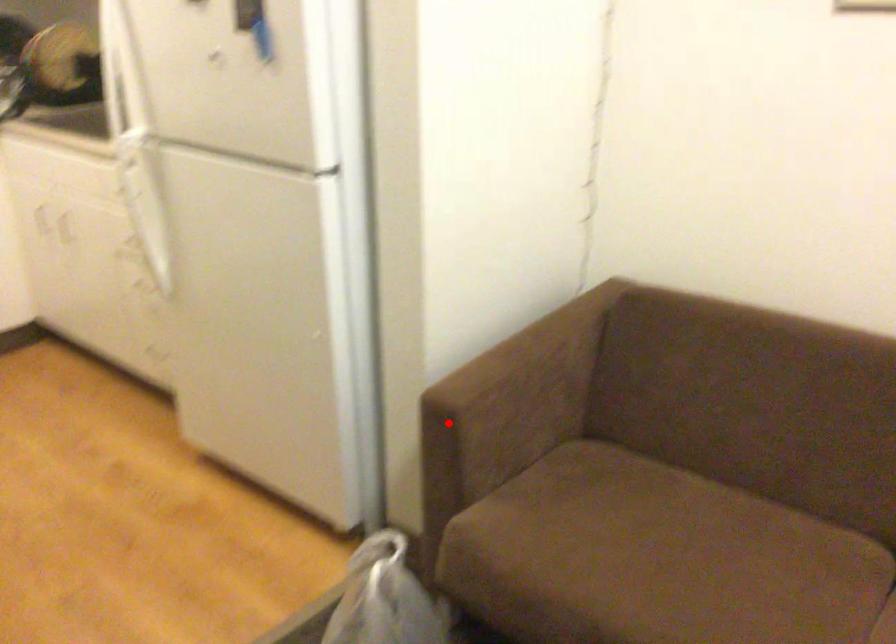
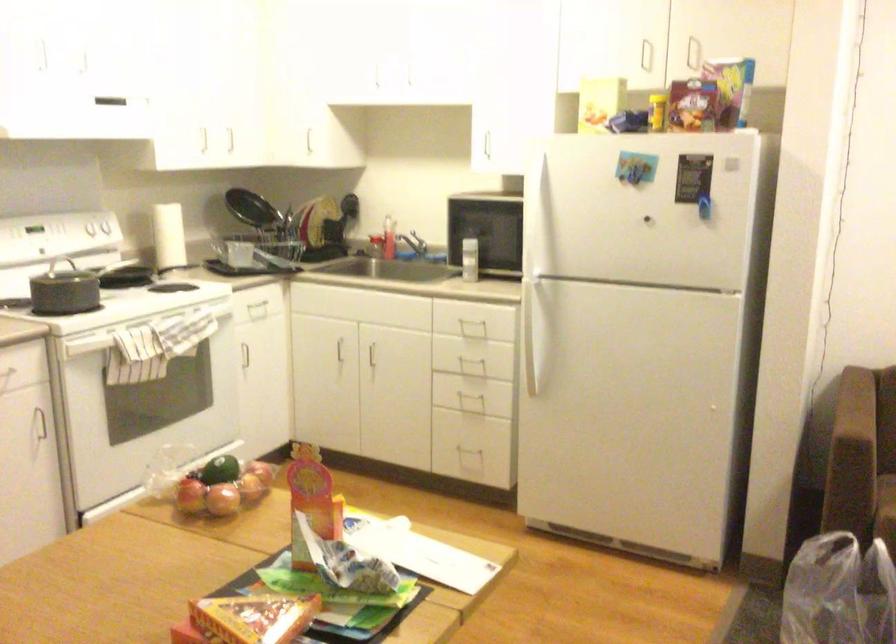
The point at the highlighted location is marked in the first image. Where is the corresponding point in the second image?

(879, 446)